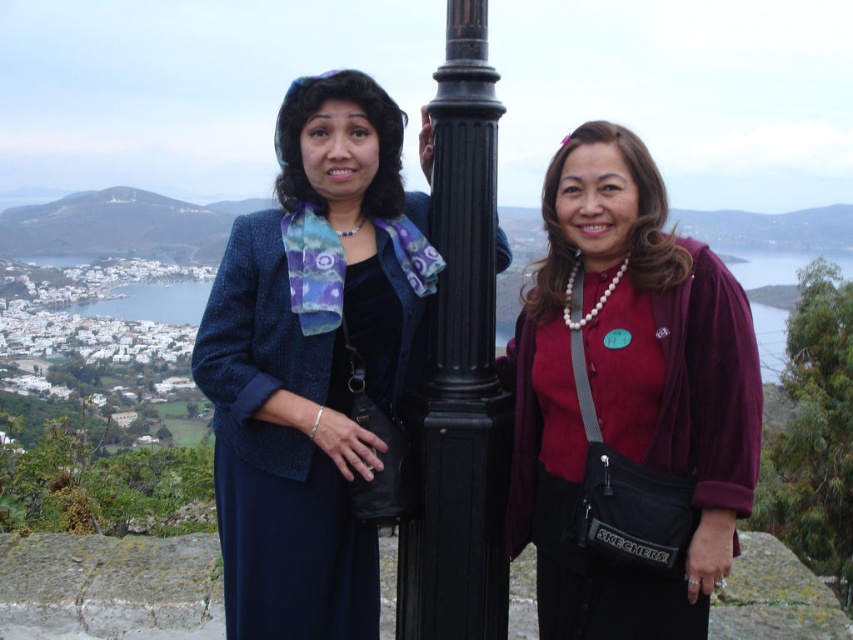
You are a photographer trying to capture a closeup shot of the velvet maroon blouse at center. Given that your camera has a minimum focus distance of 60 meters, will you be able to take the photo without moving closer?

The velvet maroon blouse at center is 66.67 meters from the camera, which is beyond the minimum focus distance of 60 meters. Therefore, you can take the photo without moving closer as the camera can focus at that distance.

From the picture: You are a photographer setting up a shoot at the coastal town scene. You need to position two models wearing the velvet maroon blouse at center and the velvet blue dress at center so that their outfits are clearly visible. Based on their current positions, which model should you move to ensure both outfits are fully visible in the frame?

The velvet maroon blouse at center is to the right of the velvet blue dress at center. To ensure both outfits are fully visible, move the model wearing the velvet maroon blouse at center further to the right so there is enough space between them.

You are trying to decide whether to hang a velvet maroon blouse at center on the black metal pole at center. Based on their sizes, will the blouse fit around the pole?

The velvet maroon blouse at center is wider than the black metal pole at center, so it should fit around the pole since its width is greater.